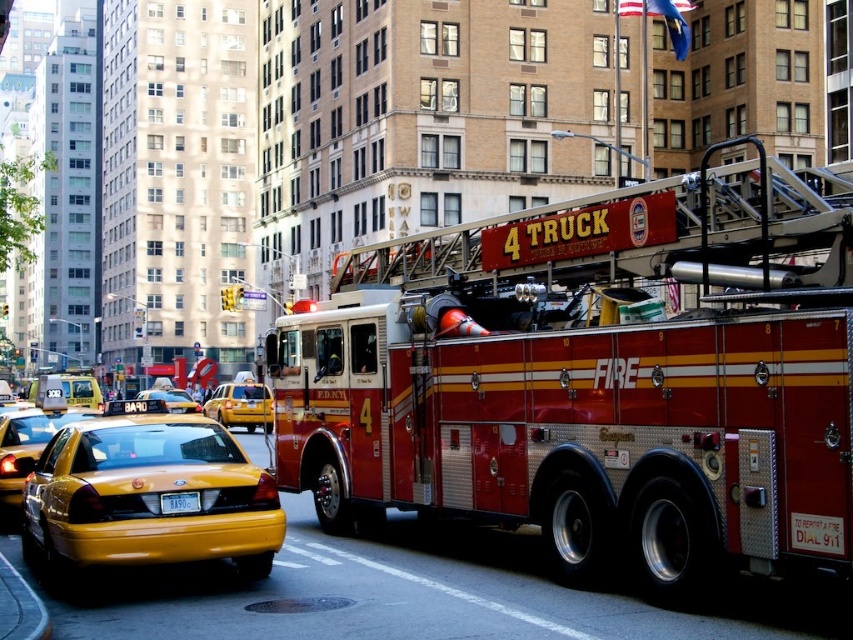
Does yellow rubber taxi cab at center have a greater width compared to yellow rubber taxi at center?

In fact, yellow rubber taxi cab at center might be narrower than yellow rubber taxi at center.

Measure the distance between point (x=219, y=392) and camera.

Point (x=219, y=392) and camera are 37.83 meters apart.

You are a GUI agent. You are given a task and a screenshot of the screen. Output one action in this format:
    pyautogui.click(x=<x>, y=<y>)
    Task: Click on the yellow rubber taxi cab at center
    This screenshot has width=853, height=640.
    Given the screenshot: What is the action you would take?
    pyautogui.click(x=241, y=404)

Does yellow rubber taxi at center have a lesser height compared to yellow plastic license plate at lower center?

In fact, yellow rubber taxi at center may be taller than yellow plastic license plate at lower center.

How much distance is there between yellow rubber taxi at center and yellow plastic license plate at lower center?

yellow rubber taxi at center is 6.27 meters away from yellow plastic license plate at lower center.

You are a GUI agent. You are given a task and a screenshot of the screen. Output one action in this format:
    pyautogui.click(x=<x>, y=<y>)
    Task: Click on the yellow rubber taxi at center
    
    Given the screenshot: What is the action you would take?
    pyautogui.click(x=172, y=400)

I want to click on yellow rubber taxi at center, so click(x=172, y=400).

Does point (25, 454) come closer to viewer compared to point (155, 397)?

Yes, it is in front of point (155, 397).

Does yellow glossy taxi cab at lower left appear on the right side of yellow rubber taxi at center?

Correct, you'll find yellow glossy taxi cab at lower left to the right of yellow rubber taxi at center.

You are a GUI agent. You are given a task and a screenshot of the screen. Output one action in this format:
    pyautogui.click(x=<x>, y=<y>)
    Task: Click on the yellow glossy taxi cab at lower left
    Image resolution: width=853 pixels, height=640 pixels.
    Given the screenshot: What is the action you would take?
    pyautogui.click(x=21, y=448)